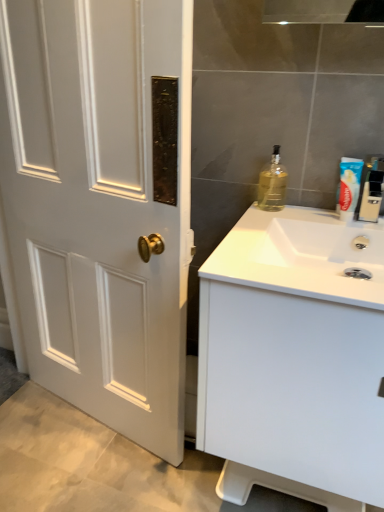
Locate an element on the screen. Image resolution: width=384 pixels, height=512 pixels. free space that is to the left of clear plastic toothpaste tube at upper right, which appears as the second bottle when viewed from the left is located at coordinates (305, 222).